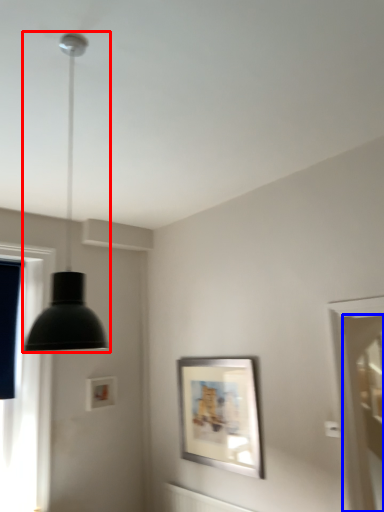
Question: Which of the following is the closest to the observer, lamp (highlighted by a red box) or screen door (highlighted by a blue box)?

Choices:
 (A) lamp
 (B) screen door

Answer: (A)